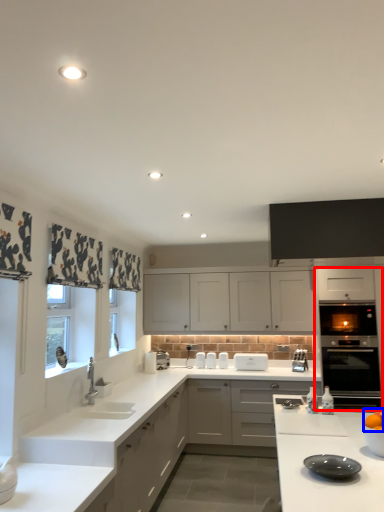
Question: Which point is further to the camera, oven (highlighted by a red box) or orange (highlighted by a blue box)?

Choices:
 (A) oven
 (B) orange

Answer: (A)